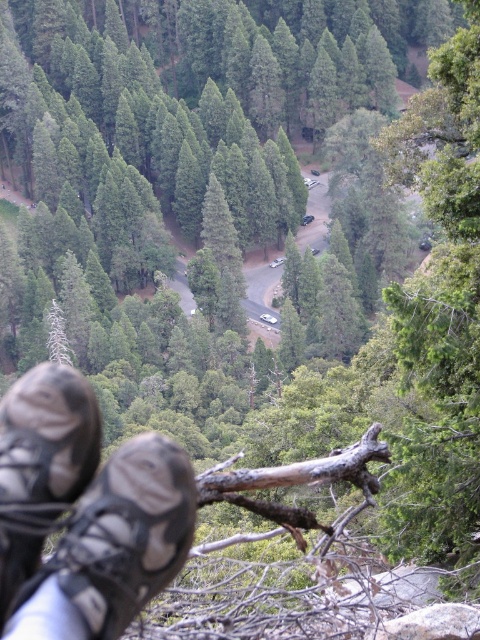
Question: Which point is farther from the camera taking this photo?

Choices:
 (A) (23, 589)
 (B) (0, 547)

Answer: (A)

Question: Does black mesh shoe at lower left lie behind black suede shoe at lower left?

Choices:
 (A) no
 (B) yes

Answer: (A)

Question: Is black mesh shoe at lower left positioned in front of black suede shoe at lower left?

Choices:
 (A) yes
 (B) no

Answer: (A)

Question: Is black mesh shoe at lower left positioned behind black suede shoe at lower left?

Choices:
 (A) yes
 (B) no

Answer: (B)